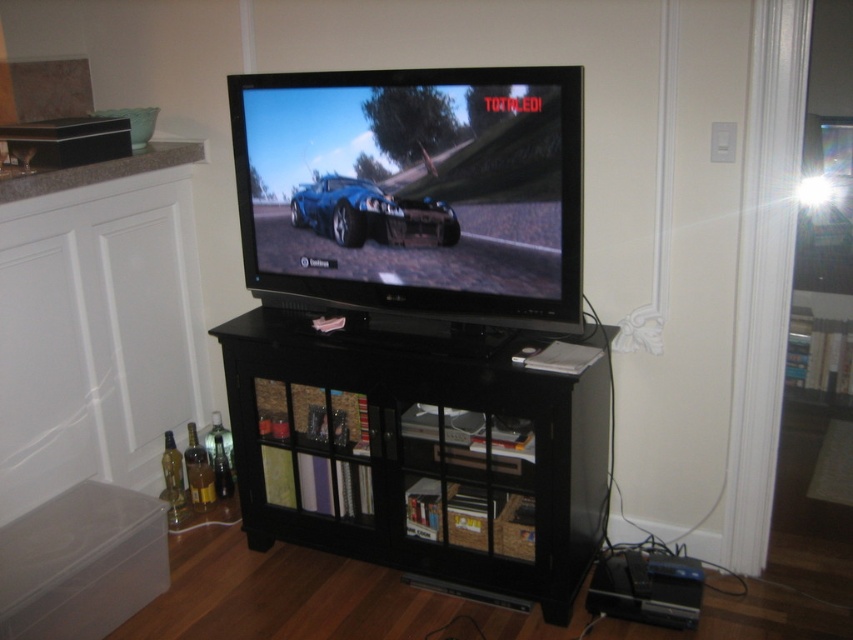
Imagine you are standing in the living room looking at the flat screen television. There are two points marked in the image, one at coordinate point (473, 513) and the other at point (366, 221). Which of these two points is closer to you?

Point (366, 221) is closer to you because it is less further to the camera than point (473, 513).

You are moving the black glossy flat screen tv at center to another room. Can you place the black glossy entertainment center at center on the same spot where the TV was?

The black glossy entertainment center at center has a larger size compared to the black glossy flat screen tv at center, so it cannot be placed in the same spot where the TV was because it would not fit.